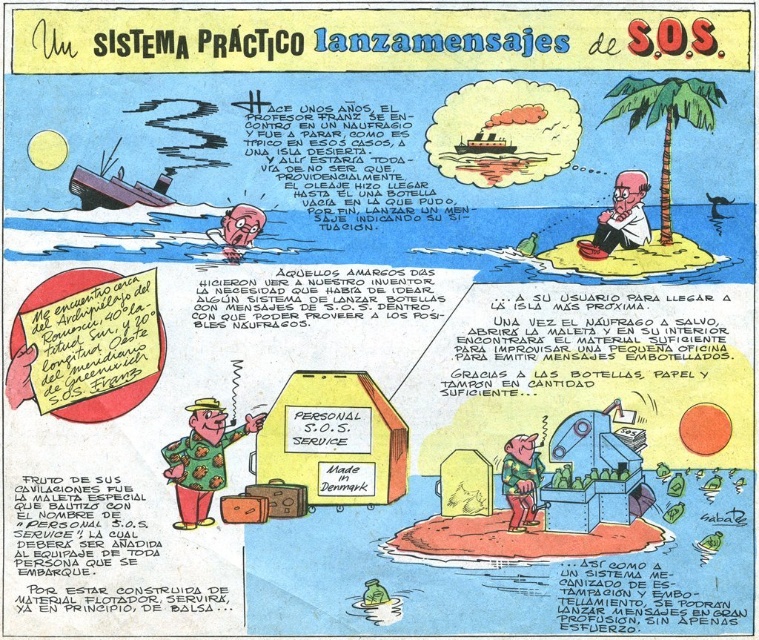
Who is shorter, polka dot fabric suitcase at center or white paper at upper center?

white paper at upper center

Does polka dot fabric suitcase at center lie behind white paper at upper center?

No, polka dot fabric suitcase at center is closer to the viewer.

This screenshot has width=759, height=640. What do you see at coordinates (202, 460) in the screenshot?
I see `polka dot fabric suitcase at center` at bounding box center [202, 460].

This screenshot has width=759, height=640. What are the coordinates of `polka dot fabric suitcase at center` in the screenshot? It's located at click(x=202, y=460).